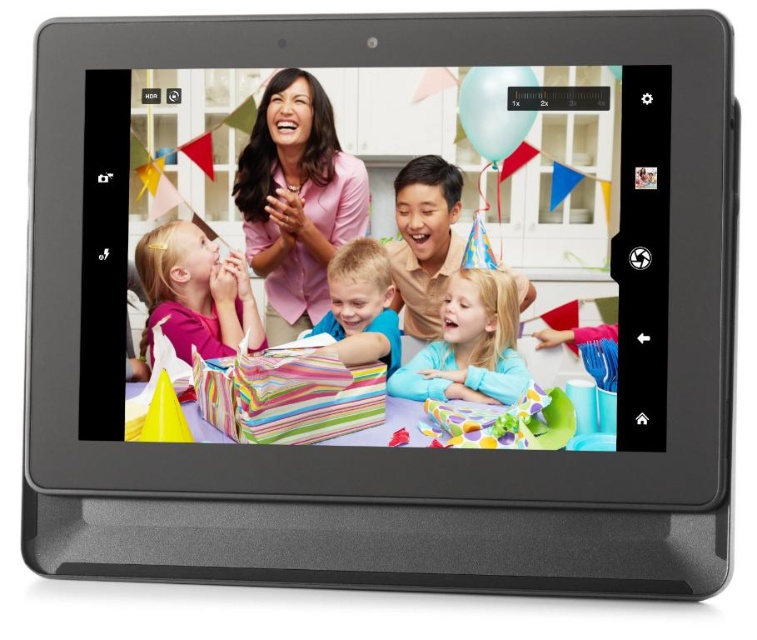
Consider the image. Who is higher up, pink matte shirt at center or pastel blue fabric at center?

pink matte shirt at center is higher up.

Is point (241, 296) positioned before point (516, 310)?

No.

Does point (198, 284) come in front of point (488, 376)?

That is False.

Locate an element on the screen. The width and height of the screenshot is (757, 640). pink matte shirt at center is located at coordinates (195, 292).

Between pink matte shirt at center and smooth blonde hair at center, which one has more height?

Standing taller between the two is smooth blonde hair at center.

Is pink matte shirt at center above smooth blonde hair at center?

Yes.

Which is in front, point (185, 241) or point (351, 332)?

Positioned in front is point (185, 241).

Find the location of a particular element. This screenshot has width=757, height=640. pink matte shirt at center is located at coordinates (195, 292).

Does pastel blue fabric at center lie in front of smooth blonde hair at center?

Yes, pastel blue fabric at center is closer to the viewer.

Does pastel blue fabric at center have a lesser height compared to smooth blonde hair at center?

Yes, pastel blue fabric at center is shorter than smooth blonde hair at center.

Who is more distant from viewer, (x=463, y=321) or (x=335, y=330)?

The point (x=335, y=330) is more distant.

The width and height of the screenshot is (757, 640). Find the location of `pastel blue fabric at center`. pastel blue fabric at center is located at coordinates (469, 346).